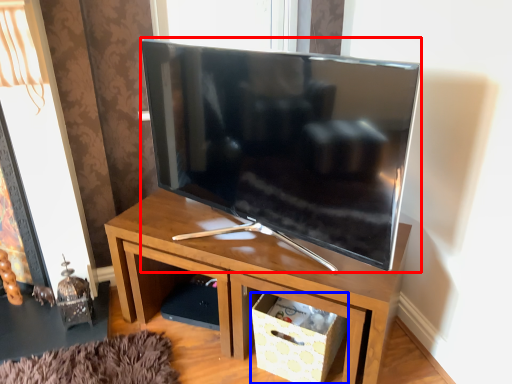
Question: Which of the following is the farthest to the observer, television (highlighted by a red box) or storage box (highlighted by a blue box)?

Choices:
 (A) television
 (B) storage box

Answer: (B)